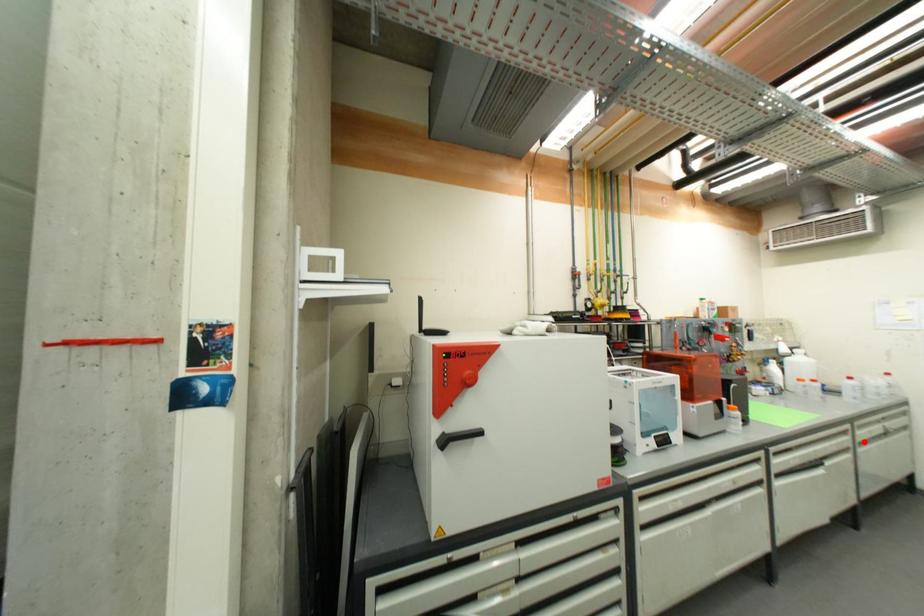
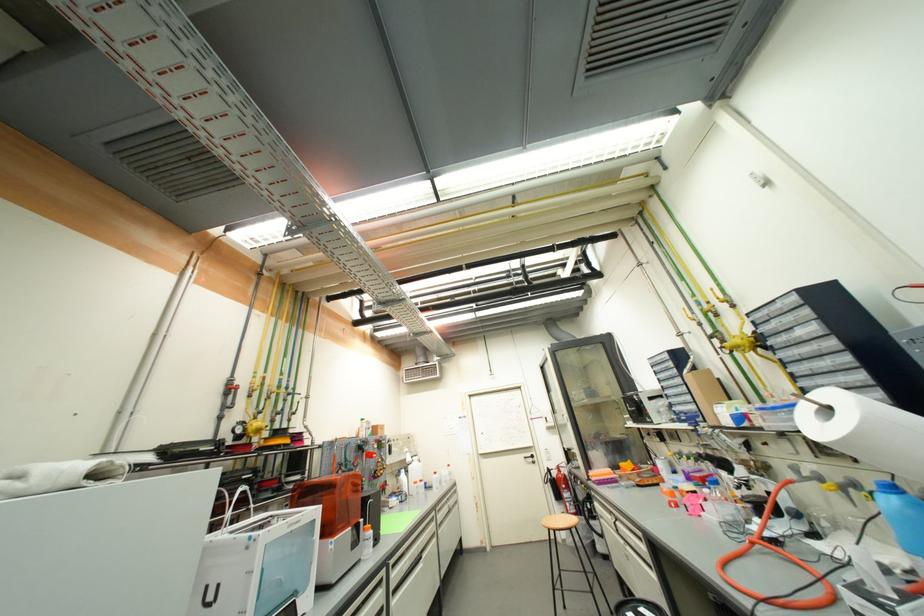
In the second image, find the point that corresponds to the highlighted location in the first image.

(444, 525)